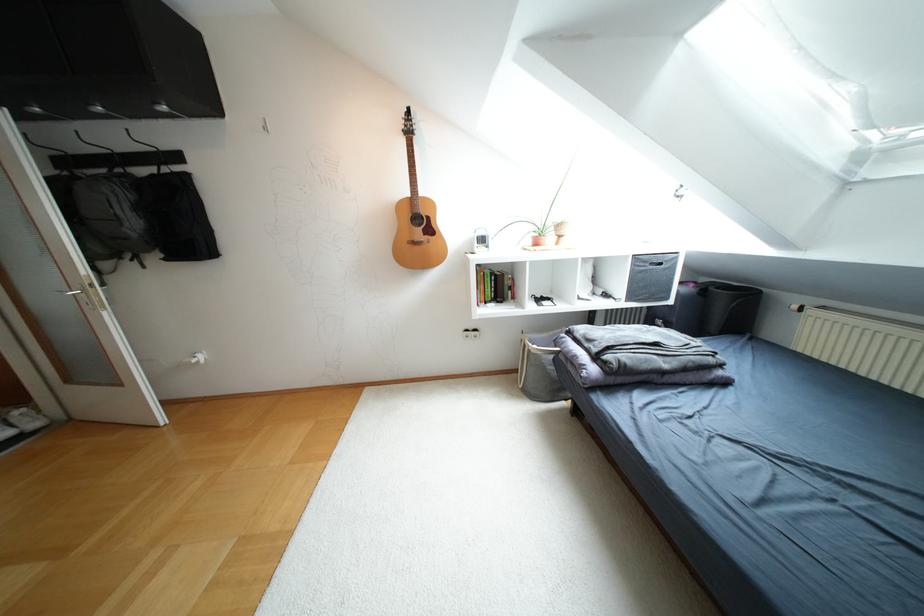
Where would you turn the metal door handle? Please return your answer as a coordinate pair (x, y).

(81, 294)